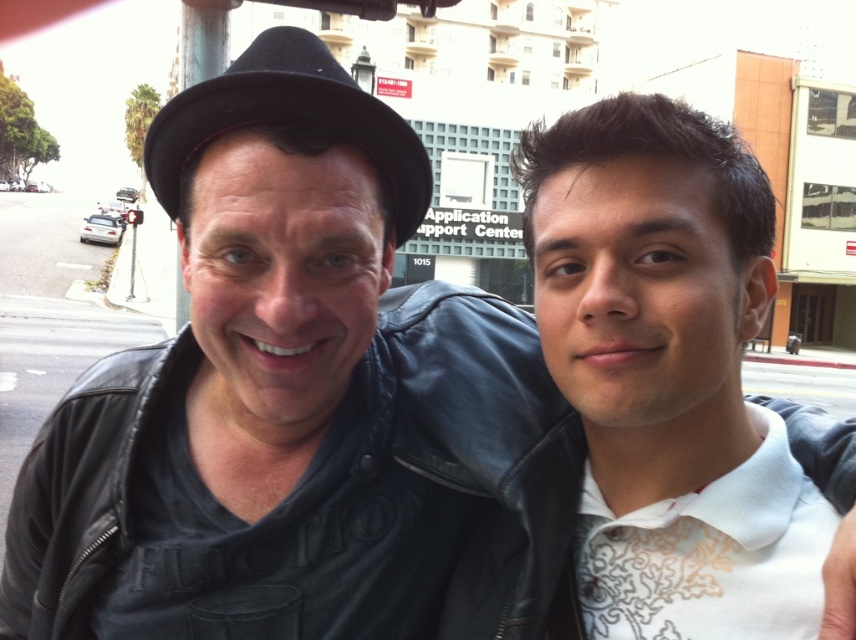
How much distance is there between white textured shirt at center and black felt plug hat at upper left?

They are 20.86 inches apart.

What do you see at coordinates (649, 289) in the screenshot? This screenshot has height=640, width=856. I see `white textured shirt at center` at bounding box center [649, 289].

What do you see at coordinates (649, 289) in the screenshot? I see `white textured shirt at center` at bounding box center [649, 289].

The image size is (856, 640). What are the coordinates of `white textured shirt at center` in the screenshot? It's located at [x=649, y=289].